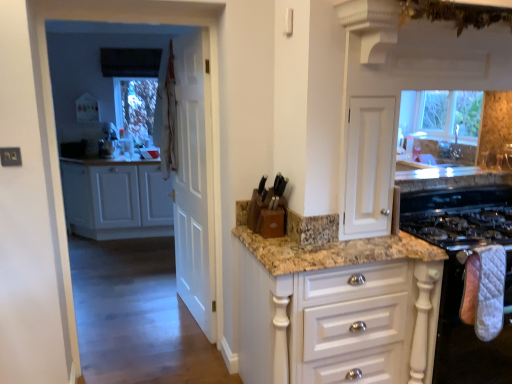
Question: Considering the relative sizes of white wood cabinets at left, which appears as the 2th cabinetry when viewed from the right, and white glossy cabinet at center, which is counted as the first cabinetry, starting from the front, in the image provided, is white wood cabinets at left, which appears as the 2th cabinetry when viewed from the right, smaller than white glossy cabinet at center, which is counted as the first cabinetry, starting from the front,?

Choices:
 (A) yes
 (B) no

Answer: (B)

Question: From the image's perspective, is white wood cabinets at left, acting as the first cabinetry starting from the back, on white glossy cabinet at center, the first cabinetry in the right-to-left sequence?

Choices:
 (A) yes
 (B) no

Answer: (A)

Question: Is white wood cabinets at left, which is the first cabinetry from left to right, not inside white glossy cabinet at center, which ranks as the second cabinetry in back-to-front order?

Choices:
 (A) no
 (B) yes

Answer: (B)

Question: Can you confirm if white wood cabinets at left, which appears as the 2th cabinetry when viewed from the right, is positioned to the left of white glossy cabinet at center, the first cabinetry in the right-to-left sequence?

Choices:
 (A) yes
 (B) no

Answer: (A)

Question: From a real-world perspective, is white wood cabinets at left, which is the first cabinetry from left to right, physically above white glossy cabinet at center, which is counted as the first cabinetry, starting from the front?

Choices:
 (A) no
 (B) yes

Answer: (B)

Question: Is point (177, 139) closer or farther from the camera than point (417, 344)?

Choices:
 (A) closer
 (B) farther

Answer: (B)

Question: In terms of width, does white fabric curtain at upper left look wider or thinner when compared to white glossy cabinet at center, the first cabinetry in the right-to-left sequence?

Choices:
 (A) wide
 (B) thin

Answer: (B)

Question: In terms of height, does white fabric curtain at upper left look taller or shorter compared to white glossy cabinet at center, which ranks as the second cabinetry in back-to-front order?

Choices:
 (A) tall
 (B) short

Answer: (A)

Question: Is white fabric curtain at upper left inside the boundaries of white glossy cabinet at center, the first cabinetry in the right-to-left sequence, or outside?

Choices:
 (A) outside
 (B) inside

Answer: (A)

Question: Based on their sizes in the image, would you say white quilted oven mitt at right, which is counted as the second appliance, starting from the top, is bigger or smaller than white glossy cabinet at center, which is the 2th cabinetry in left-to-right order?

Choices:
 (A) big
 (B) small

Answer: (A)

Question: In the image, is white quilted oven mitt at right, the 1th appliance in the bottom-to-top sequence, positioned in front of or behind white glossy cabinet at center, which is counted as the first cabinetry, starting from the front?

Choices:
 (A) behind
 (B) front

Answer: (A)

Question: In terms of width, does white quilted oven mitt at right, acting as the second appliance starting from the left, look wider or thinner when compared to white glossy cabinet at center, which is the 2th cabinetry in left-to-right order?

Choices:
 (A) thin
 (B) wide

Answer: (A)

Question: Is white quilted oven mitt at right, the 1th appliance in the bottom-to-top sequence, spatially inside white glossy cabinet at center, which is counted as the first cabinetry, starting from the front, or outside of it?

Choices:
 (A) outside
 (B) inside

Answer: (A)

Question: Is white quilted oven mitt at lower right in front of or behind white fabric curtain at upper left in the image?

Choices:
 (A) front
 (B) behind

Answer: (A)

Question: Based on their positions, is white quilted oven mitt at lower right located to the left or right of white fabric curtain at upper left?

Choices:
 (A) right
 (B) left

Answer: (A)